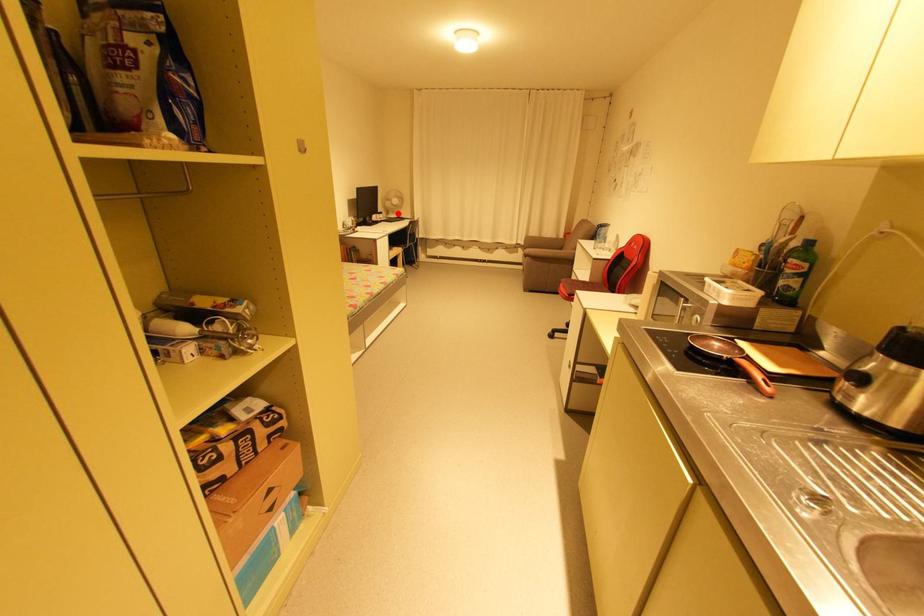
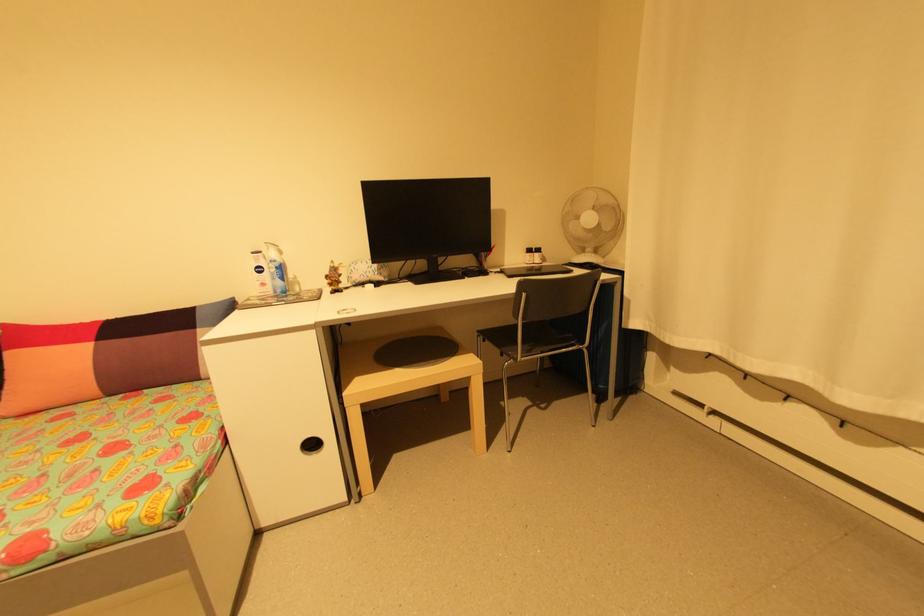
Question: I am providing you with two images of the same scene from different viewpoints. Given a red point in image1, look at the same physical point in image2. Is it:

Choices:
 (A) Closer to the viewpoint
 (B) Farther from the viewpoint

Answer: (B)